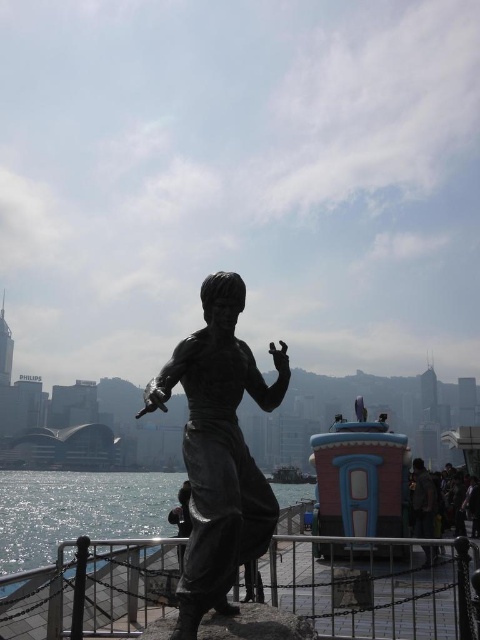
Question: Which object is farther from the camera taking this photo?

Choices:
 (A) bronze statue at center
 (B) glistening silver water at center

Answer: (B)

Question: Estimate the real-world distances between objects in this image. Which object is closer to the bronze statue at center?

Choices:
 (A) glistening silver water at center
 (B) dark brown leather jacket at lower right
 (C) metal/rusty rail at lower center

Answer: (C)

Question: Does bronze statue at center lie behind dark brown leather jacket at lower right?

Choices:
 (A) yes
 (B) no

Answer: (B)

Question: Among these points, which one is farthest from the camera?

Choices:
 (A) (199, 355)
 (B) (153, 592)

Answer: (B)

Question: Does bronze statue at center have a smaller size compared to glistening silver water at center?

Choices:
 (A) no
 (B) yes

Answer: (B)

Question: Can you confirm if metal/rusty rail at lower center is thinner than dark brown leather jacket at lower right?

Choices:
 (A) no
 (B) yes

Answer: (A)